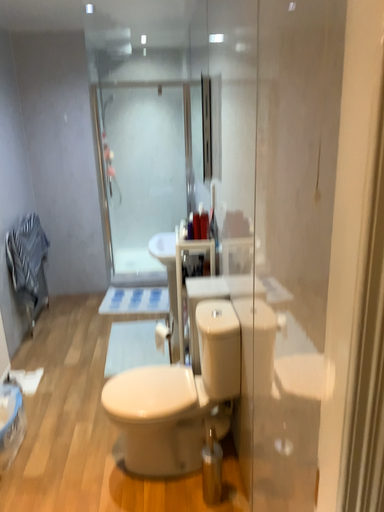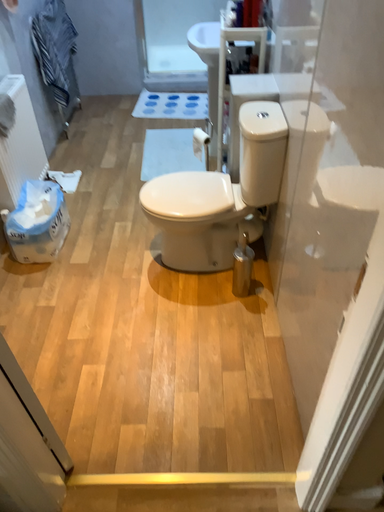
Question: Which way did the camera rotate in the video?

Choices:
 (A) rotated upward
 (B) rotated downward

Answer: (B)